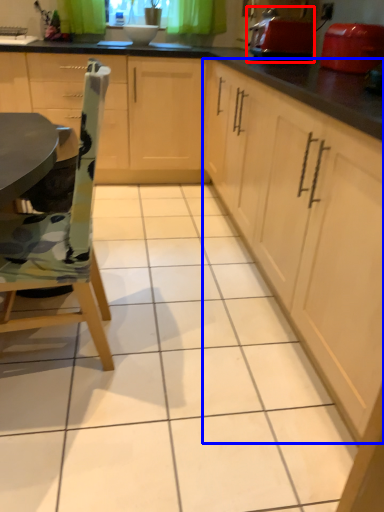
Question: Among these objects, which one is nearest to the camera, appliance (highlighted by a red box) or cabinetry (highlighted by a blue box)?

Choices:
 (A) appliance
 (B) cabinetry

Answer: (B)